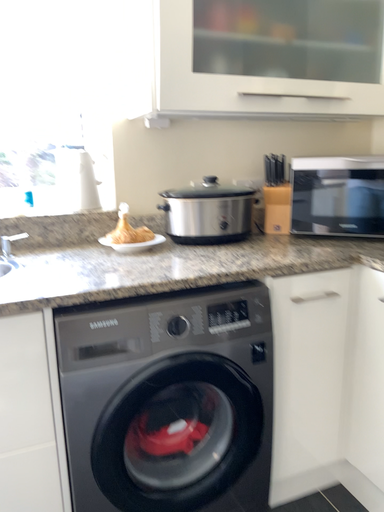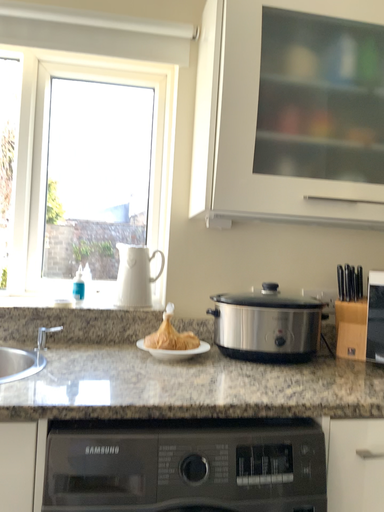
Question: Which way did the camera rotate in the video?

Choices:
 (A) rotated right
 (B) rotated left

Answer: (B)